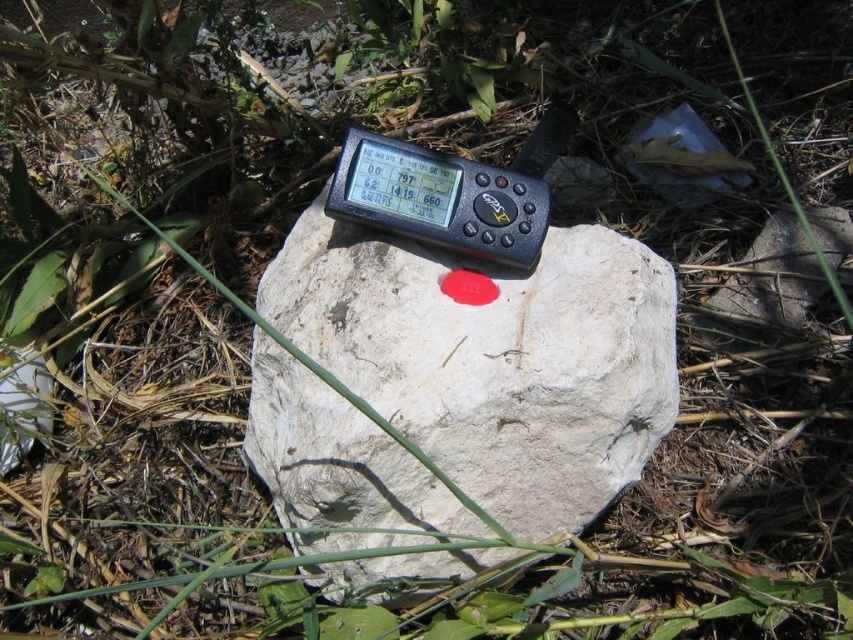
Question: Which point is farther to the camera?

Choices:
 (A) white rough rock at center
 (B) black plastic thermometer at center

Answer: (B)

Question: Considering the relative positions of white rough rock at center and black plastic thermometer at center in the image provided, where is white rough rock at center located with respect to black plastic thermometer at center?

Choices:
 (A) below
 (B) above

Answer: (A)

Question: Is white rough rock at center further to the viewer compared to black plastic thermometer at center?

Choices:
 (A) yes
 (B) no

Answer: (B)

Question: Which point appears closest to the camera in this image?

Choices:
 (A) pyautogui.click(x=412, y=156)
 (B) pyautogui.click(x=521, y=486)

Answer: (B)

Question: Is white rough rock at center to the left of black plastic thermometer at center from the viewer's perspective?

Choices:
 (A) no
 (B) yes

Answer: (A)